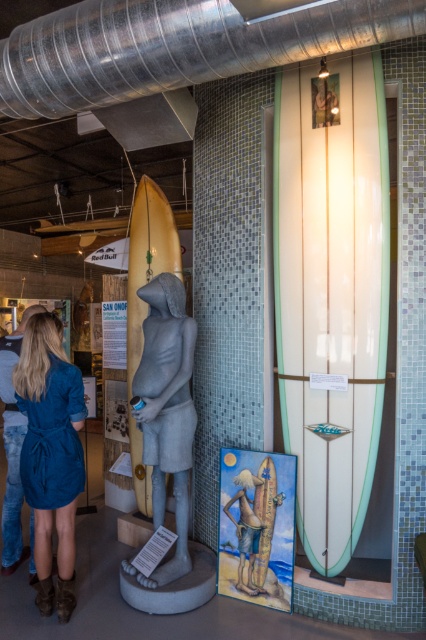
Question: Which of the following is the farthest from the observer?

Choices:
 (A) yellow matte surfboard at center
 (B) gray stone statue at center
 (C) white glossy surfboard at center

Answer: (A)

Question: Does gray stone statue at center have a greater width compared to yellow matte surfboard at center?

Choices:
 (A) no
 (B) yes

Answer: (A)

Question: Is yellow matte surfboard at center thinner than white glossy surfboard at center?

Choices:
 (A) no
 (B) yes

Answer: (A)

Question: Does gray stone statue at center lie behind yellow matte surfboard at center?

Choices:
 (A) yes
 (B) no

Answer: (B)

Question: Which point is farther to the camera?

Choices:
 (A) (6, 552)
 (B) (54, 419)
 (C) (226, 512)

Answer: (A)

Question: Among these objects, which one is farthest from the camera?

Choices:
 (A) beige fabric surfboard at center
 (B) denim dress at lower left
 (C) white glossy surfboard at center

Answer: (B)